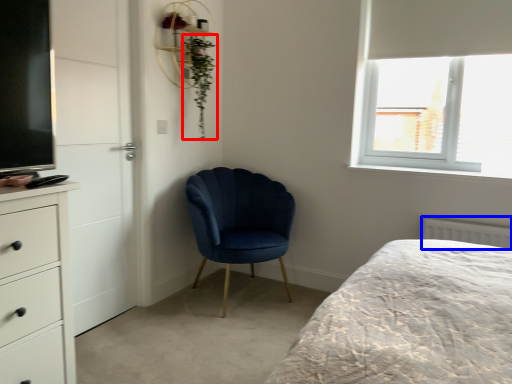
Question: Which object is closer to the camera taking this photo, plant (highlighted by a red box) or radiator (highlighted by a blue box)?

Choices:
 (A) plant
 (B) radiator

Answer: (B)